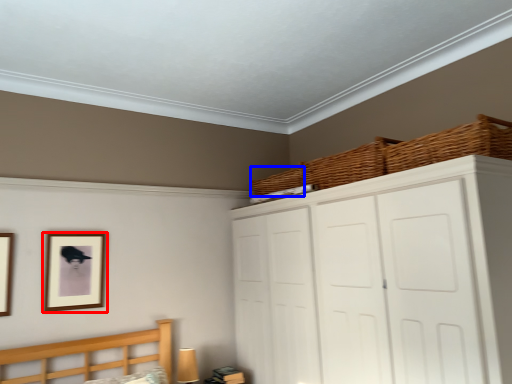
Question: Which of the following is the farthest to the observer, picture frame (highlighted by a red box) or basket (highlighted by a blue box)?

Choices:
 (A) picture frame
 (B) basket

Answer: (B)